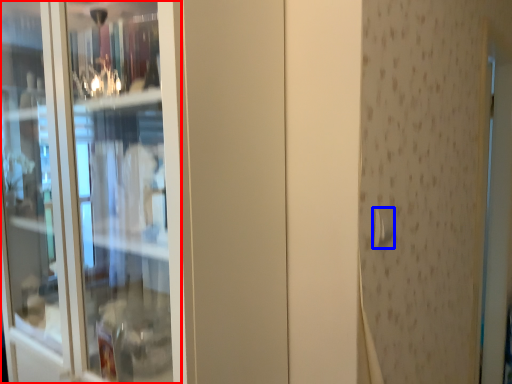
Question: Which object is closer to the camera taking this photo, screen door (highlighted by a red box) or door handle (highlighted by a blue box)?

Choices:
 (A) screen door
 (B) door handle

Answer: (A)